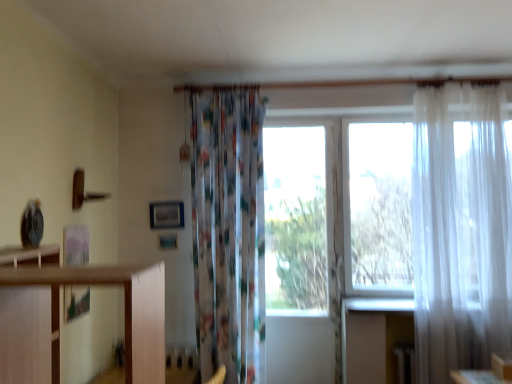
Question: From the image's perspective, is translucent white curtain at right, which is the 2th curtain from left to right, below transparent glass window at center?

Choices:
 (A) yes
 (B) no

Answer: (B)

Question: Can you confirm if translucent white curtain at right, the 1th curtain when ordered from right to left, is thinner than transparent glass window at center?

Choices:
 (A) yes
 (B) no

Answer: (B)

Question: Is transparent glass window at center at the back of translucent white curtain at right, the 1th curtain when ordered from right to left?

Choices:
 (A) yes
 (B) no

Answer: (B)

Question: Could transparent glass window at center be considered to be inside translucent white curtain at right, which is the 2th curtain from left to right?

Choices:
 (A) no
 (B) yes

Answer: (A)

Question: Does translucent white curtain at right, which is the 2th curtain from left to right, have a smaller size compared to transparent glass window at center?

Choices:
 (A) yes
 (B) no

Answer: (B)

Question: Is the position of translucent white curtain at right, which is the 2th curtain from left to right, less distant than that of transparent glass window at center?

Choices:
 (A) yes
 (B) no

Answer: (A)

Question: Is transparent glass window at center placed right next to printed fabric curtain at center, the second curtain positioned from the right?

Choices:
 (A) no
 (B) yes

Answer: (A)

Question: Can you confirm if transparent glass window at center is taller than printed fabric curtain at center, arranged as the 1th curtain when viewed from the left?

Choices:
 (A) no
 (B) yes

Answer: (B)

Question: From the image's perspective, is transparent glass window at center located above printed fabric curtain at center, arranged as the 1th curtain when viewed from the left?

Choices:
 (A) yes
 (B) no

Answer: (B)

Question: Does transparent glass window at center have a lesser height compared to printed fabric curtain at center, arranged as the 1th curtain when viewed from the left?

Choices:
 (A) no
 (B) yes

Answer: (A)

Question: Is transparent glass window at center wider than printed fabric curtain at center, the second curtain positioned from the right?

Choices:
 (A) no
 (B) yes

Answer: (A)

Question: From a real-world perspective, does transparent glass window at center sit lower than printed fabric curtain at center, arranged as the 1th curtain when viewed from the left?

Choices:
 (A) yes
 (B) no

Answer: (A)

Question: Is transparent white curtain at right in front of transparent glass window at center?

Choices:
 (A) no
 (B) yes

Answer: (B)